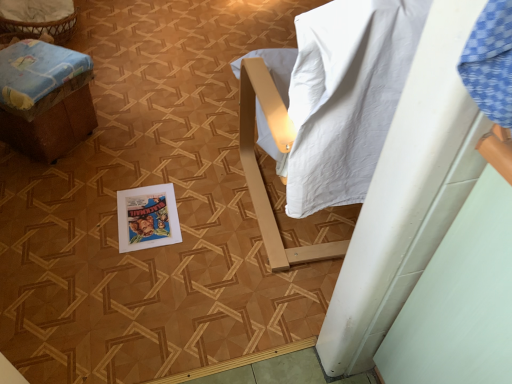
Where is `vacant area on the back side of brown cardboard box at left`? The width and height of the screenshot is (512, 384). vacant area on the back side of brown cardboard box at left is located at coordinates (124, 90).